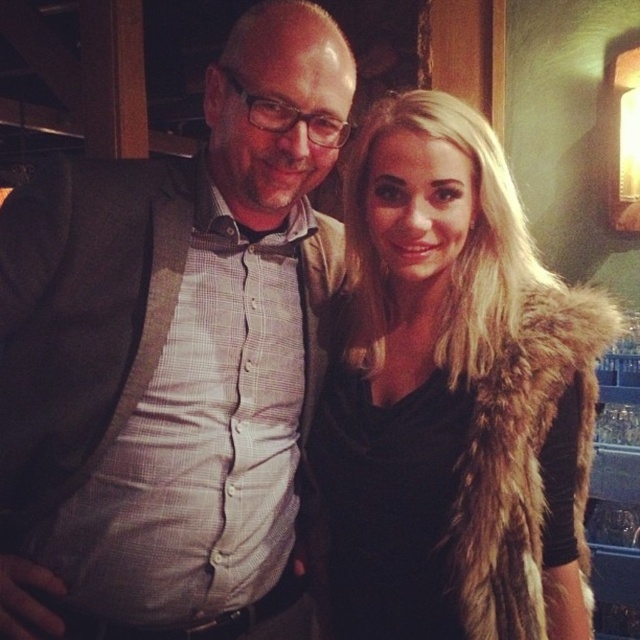
You are standing in the middle of the room and want to reach the matte gray blazer at center. Which direction should you move to get closer to it?

Since the matte gray blazer at center is located at point 0.561 on the x and 0.272 on the y, you should move towards the right and forward to get closer to it.

You are a photographer setting up for a group photo. You notice the matte gray blazer at center and the fur vest at center in the scene. From the photographer perspective, which clothing item is positioned more to the left?

The matte gray blazer at center is positioned more to the left than the fur vest at center.